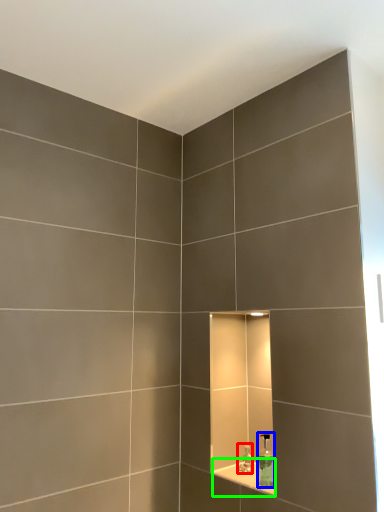
Question: Estimate the real-world distances between objects in this image. Which object is closer to faucet (highlighted by a red box), soap dispenser (highlighted by a blue box) or ledge (highlighted by a green box)?

Choices:
 (A) soap dispenser
 (B) ledge

Answer: (B)